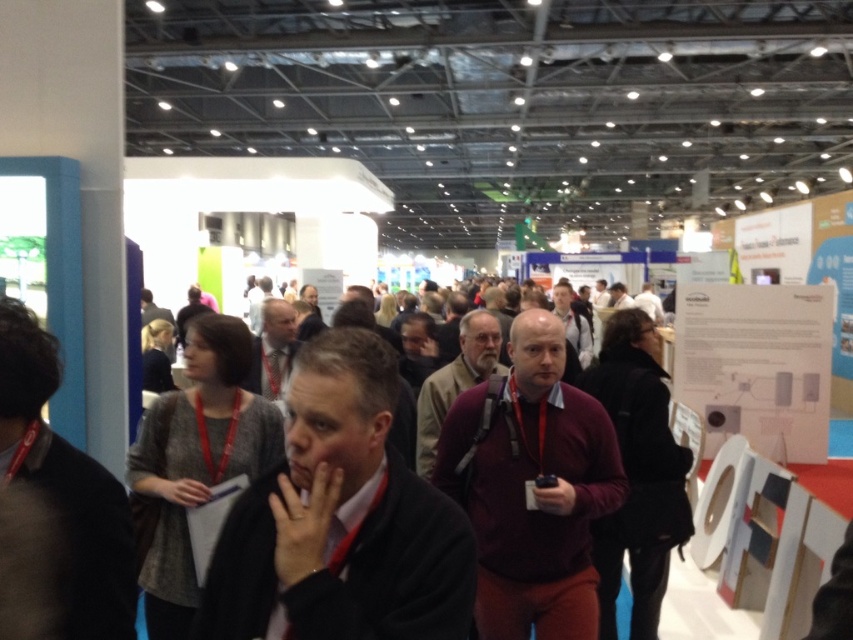
You are an event planner trying to arrange seating for two people wearing the maroon sweater at center and matte gray suit at center. Which of the two requires a wider seat?

The maroon sweater at center requires a wider seat because its width is larger than that of the matte gray suit at center.

You are an event organizer checking the layout of the exhibition hall. You notice two jackets left behind near the entrance. The black fabric jacket at left and the dark brown leather jacket at center. Which jacket is positioned closer to the left side of the entrance?

The black fabric jacket at left is positioned to the left of the dark brown leather jacket at center, so it is closer to the left side of the entrance.

Based on the photo, you are an event planner trying to arrange a path between the black fabric jacket at left and the gray fabric jacket at center. If the path needs to be at least 6 feet wide to accommodate foot traffic, can the existing space between them accommodate this requirement?

The distance between the black fabric jacket at left and the gray fabric jacket at center is 6.39 feet, which exceeds the required 6 feet width. Therefore, the existing space can accommodate the path for foot traffic.